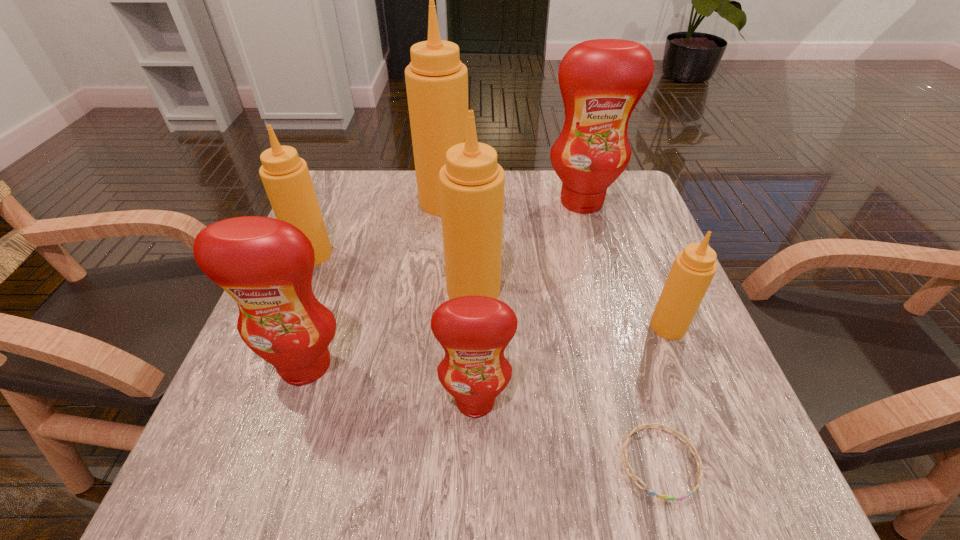
The width and height of the screenshot is (960, 540). Identify the location of the farthest tan condiment. (436, 80).

Identify the location of the tallest object. Image resolution: width=960 pixels, height=540 pixels. coord(436,80).

Locate an element on the screen. The width and height of the screenshot is (960, 540). the farthest red condiment is located at coordinates (601, 81).

You are a GUI agent. You are given a task and a screenshot of the screen. Output one action in this format:
    pyautogui.click(x=<x>, y=<y>)
    Task: Click on the biggest red condiment
    Image resolution: width=960 pixels, height=540 pixels.
    Given the screenshot: What is the action you would take?
    pyautogui.click(x=601, y=81)

This screenshot has width=960, height=540. In order to click on the fifth nearest object in this screenshot , I will do `click(471, 183)`.

Locate an element on the screen. The height and width of the screenshot is (540, 960). the third farthest tan condiment is located at coordinates point(471,183).

Where is `the third biggest tan condiment`? the third biggest tan condiment is located at coordinates (285, 176).

The height and width of the screenshot is (540, 960). I want to click on the fifth nearest condiment, so [x=285, y=176].

Locate an element on the screen. the second biggest red condiment is located at coordinates coord(266,265).

I want to click on the rightmost tan condiment, so click(693, 269).